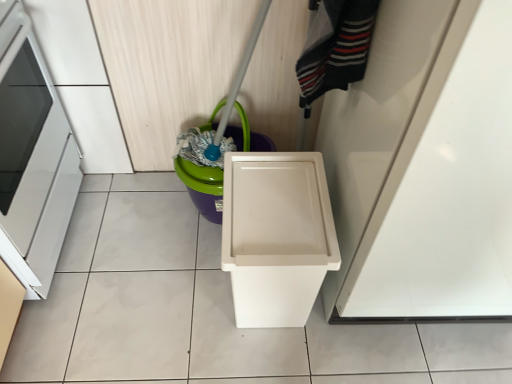
Question: From a real-world perspective, is white plastic waste container at center physically located above or below striped wool sweater at upper right?

Choices:
 (A) below
 (B) above

Answer: (A)

Question: Is white plastic waste container at center inside the boundaries of striped wool sweater at upper right, or outside?

Choices:
 (A) outside
 (B) inside

Answer: (A)

Question: Based on their relative distances, which object is nearer to the striped wool sweater at upper right?

Choices:
 (A) matte green plastic bucket at center
 (B) white glossy door at upper right
 (C) white plastic waste container at center
 (D) white glossy oven at left

Answer: (B)

Question: Estimate the real-world distances between objects in this image. Which object is closer to the white glossy oven at left?

Choices:
 (A) striped wool sweater at upper right
 (B) white plastic waste container at center
 (C) matte green plastic bucket at center
 (D) white glossy door at upper right

Answer: (C)